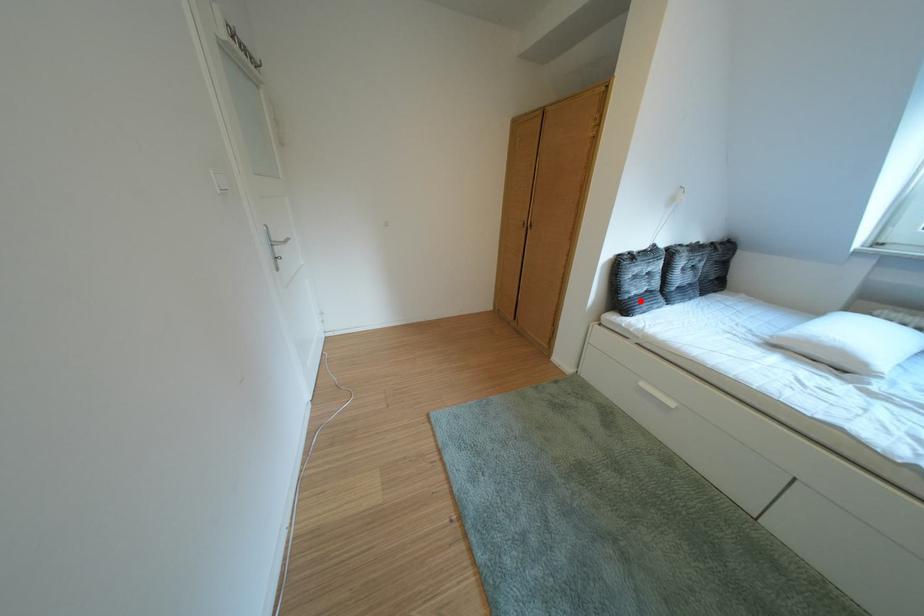
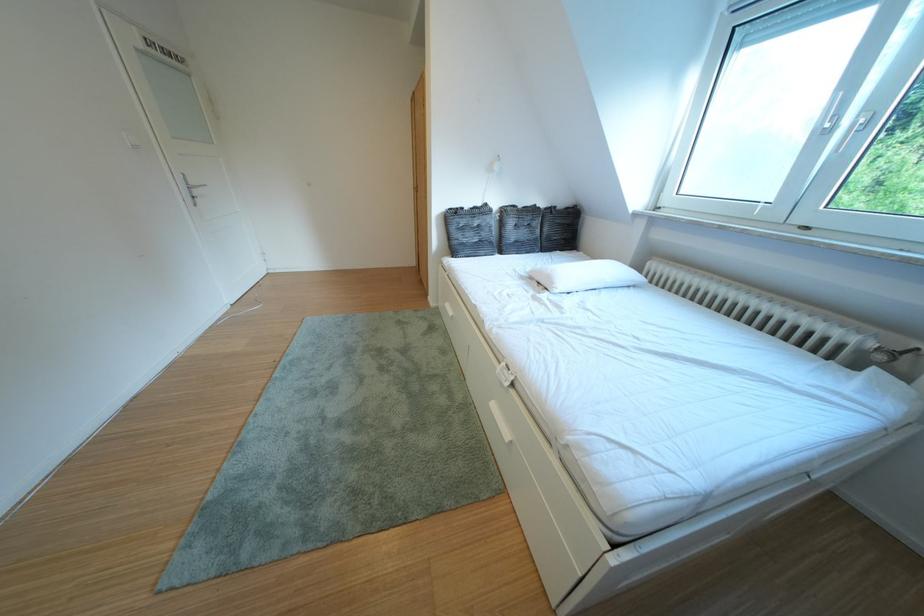
Where in the second image is the point corresponding to the highlighted location from the first image?

(468, 246)